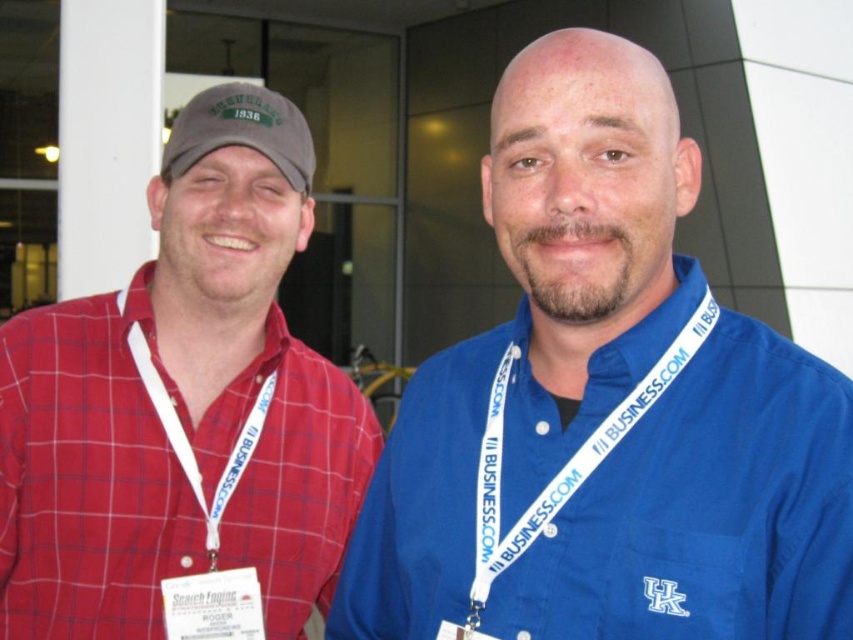
Who is more forward, [554,528] or [238,364]?

Positioned in front is point [554,528].

Describe the element at coordinates (560, 468) in the screenshot. I see `white plastic lanyard at center` at that location.

Describe the element at coordinates (560, 468) in the screenshot. The image size is (853, 640). I see `white plastic lanyard at center` at that location.

You are a GUI agent. You are given a task and a screenshot of the screen. Output one action in this format:
    pyautogui.click(x=<x>, y=<y>)
    Task: Click on the white plastic lanyard at center
    
    Given the screenshot: What is the action you would take?
    pyautogui.click(x=560, y=468)

From the picture: Can you confirm if matte red plaid shirt at left is taller than white fabric lanyard at left?

Correct, matte red plaid shirt at left is much taller as white fabric lanyard at left.

Does point (155, 410) lie behind point (129, 339)?

That is False.

Identify the location of matte red plaid shirt at left. This screenshot has width=853, height=640. (184, 413).

Does point (666, 248) come behind point (575, 296)?

Yes, point (666, 248) is farther from viewer.

Measure the distance between point (x=770, y=376) and camera.

The distance of point (x=770, y=376) from camera is 3.34 feet.

Does point (579, 285) lie in front of point (555, 352)?

That is True.

This screenshot has height=640, width=853. In order to click on blue cotton shirt at center in this screenshot , I will do `click(605, 408)`.